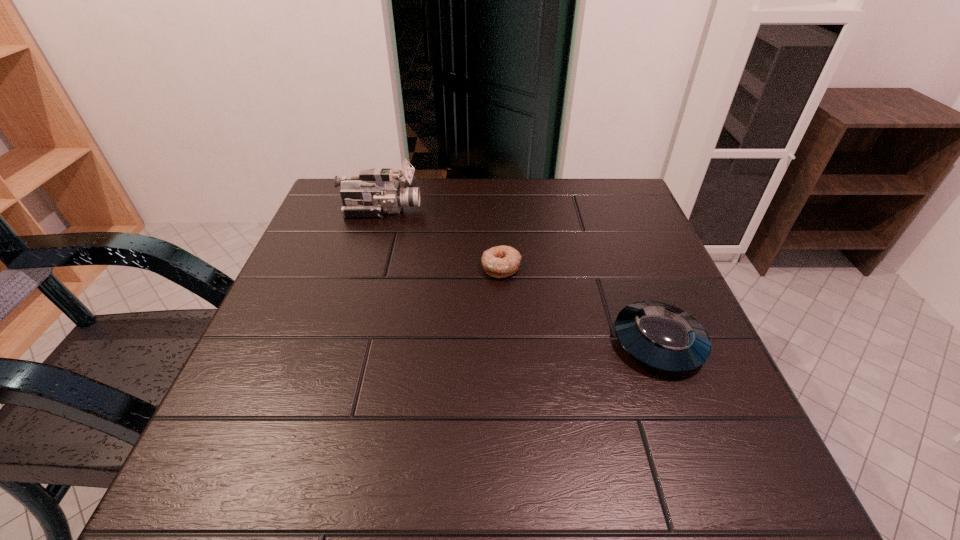
Identify the location of camcorder. (375, 192).

What are the coordinates of `the leftmost object` in the screenshot? It's located at (375, 192).

Image resolution: width=960 pixels, height=540 pixels. Identify the location of saucer. (661, 336).

Where is `the second tallest object`? the second tallest object is located at coordinates (661, 336).

This screenshot has width=960, height=540. Find the location of `doughnut`. doughnut is located at coordinates (502, 261).

You are a GUI agent. You are given a task and a screenshot of the screen. Output one action in this format:
    pyautogui.click(x=<x>, y=<y>)
    Task: Click on the shortest object
    This screenshot has height=540, width=960.
    Given the screenshot: What is the action you would take?
    pyautogui.click(x=502, y=261)

The image size is (960, 540). I want to click on vacant space located 0.340m on the front-facing side of the leftmost object, so click(549, 210).

Where is `vacant area situated 0.370m on the back of the saucer`? Image resolution: width=960 pixels, height=540 pixels. vacant area situated 0.370m on the back of the saucer is located at coordinates (607, 209).

Where is `vacant space situated 0.160m on the back of the second object from right to left`? vacant space situated 0.160m on the back of the second object from right to left is located at coordinates (498, 215).

Where is `object present at the far edge`? Image resolution: width=960 pixels, height=540 pixels. object present at the far edge is located at coordinates (375, 192).